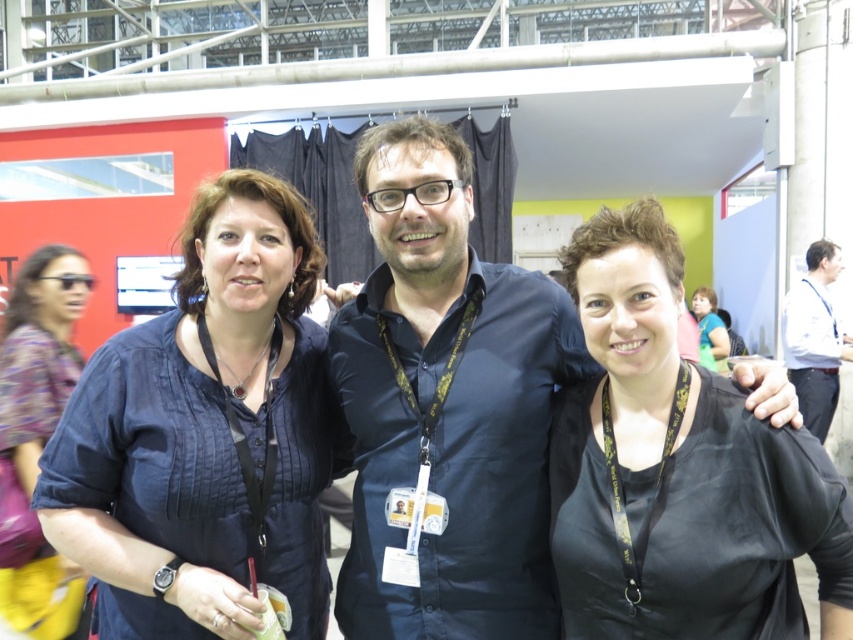
Question: Which of the following is the farthest from the observer?

Choices:
 (A) (701, 314)
 (B) (840, 356)
 (C) (28, 429)
 (D) (486, 266)

Answer: (A)

Question: Is dark blue shirt at center to the left of matte black shirt at upper right from the viewer's perspective?

Choices:
 (A) no
 (B) yes

Answer: (B)

Question: Can you confirm if dark blue shirt at center is positioned above printed fabric blouse at left?

Choices:
 (A) no
 (B) yes

Answer: (B)

Question: Does dark blue shirt at center have a greater width compared to matte black shirt at upper right?

Choices:
 (A) no
 (B) yes

Answer: (A)

Question: Based on their relative distances, which object is farther from the matte blue blouse at center?

Choices:
 (A) matte black shirt at upper right
 (B) printed fabric blouse at left

Answer: (A)

Question: Among these points, which one is nearest to the camera?

Choices:
 (A) (592, 413)
 (B) (697, 301)
 (C) (473, 504)

Answer: (A)